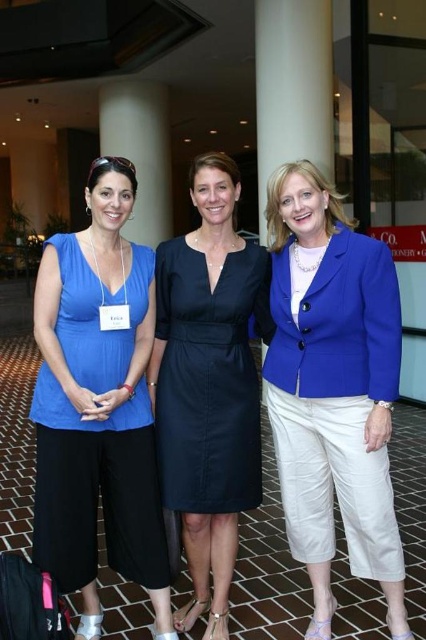
You are a photographer at this event and need to ensure that both the matte blue top at center and the navy satin dress at center are fully visible in your photo. Based on their heights, which one might require you to adjust your camera angle to avoid cropping?

The matte blue top at center is taller than the navy satin dress at center, so you might need to adjust your camera angle to ensure the taller matte blue top at center is fully visible without being cut off.